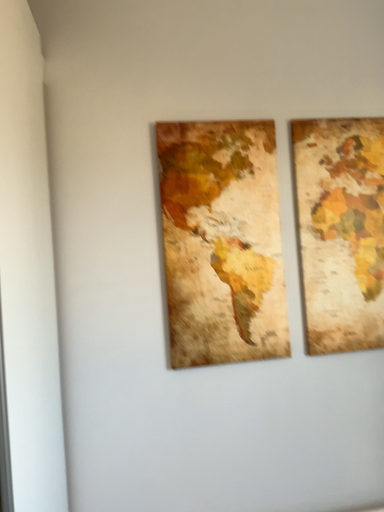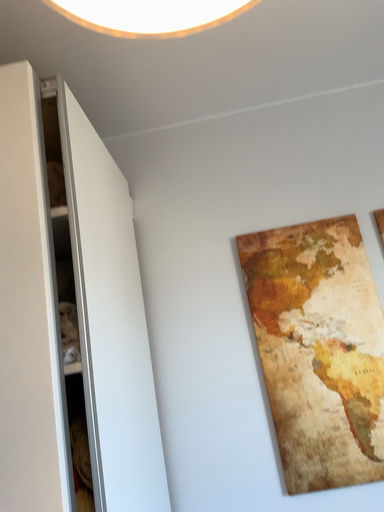
Question: Which way did the camera rotate in the video?

Choices:
 (A) rotated downward
 (B) rotated upward

Answer: (B)